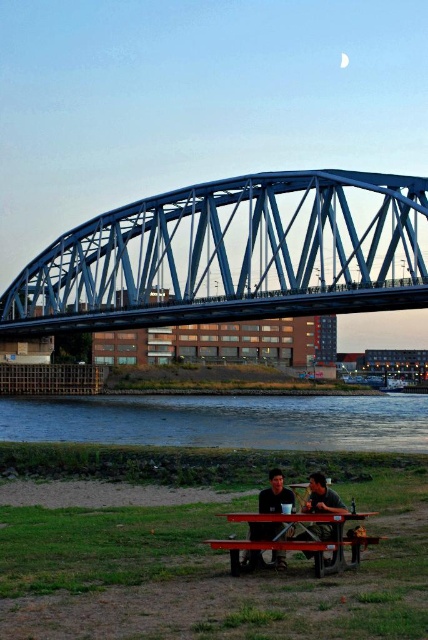
You are standing at the riverside and want to cross to the other side. The blue metallic bridge at upper center and the blue water at lower center are both in your view. Which one is closer to you?

The blue metallic bridge at upper center is closer to you because it is in front of the blue water at lower center.